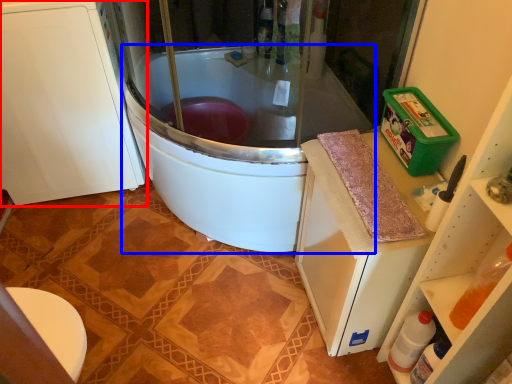
Question: Which object appears farthest to the camera in this image, cabinetry (highlighted by a red box) or bathtub (highlighted by a blue box)?

Choices:
 (A) cabinetry
 (B) bathtub

Answer: (A)